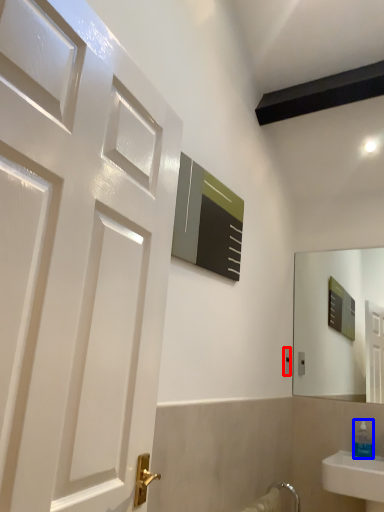
Question: Which of the following is the closest to the observer, electric outlet (highlighted by a red box) or soap dispenser (highlighted by a blue box)?

Choices:
 (A) electric outlet
 (B) soap dispenser

Answer: (B)